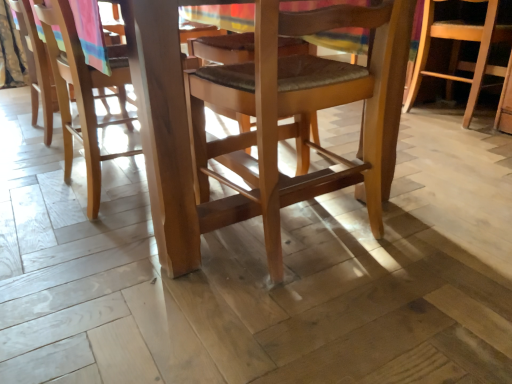
Question: From the image's perspective, does wooden chair at center, which is the 2th chair from left to right, appear lower than wooden chair at center, positioned as the 3th chair in left-to-right order?

Choices:
 (A) yes
 (B) no

Answer: (A)

Question: Can you confirm if wooden chair at center, the 3th chair from the back, is bigger than wooden chair at center, which is counted as the 1th chair, starting from the back?

Choices:
 (A) no
 (B) yes

Answer: (B)

Question: Does wooden chair at center, the second chair from the right, have a lesser width compared to wooden chair at center, the first chair viewed from the right?

Choices:
 (A) no
 (B) yes

Answer: (A)

Question: Is wooden chair at center, which appears as the first chair when viewed from the front, shorter than wooden chair at center, positioned as the 3th chair in front-to-back order?

Choices:
 (A) yes
 (B) no

Answer: (B)

Question: Is wooden chair at center, the 3th chair from the back, completely or partially outside of wooden chair at center, positioned as the 3th chair in left-to-right order?

Choices:
 (A) no
 (B) yes

Answer: (B)

Question: Is wooden chair at center, the second chair from the right, wider than wooden chair at center, the first chair viewed from the right?

Choices:
 (A) no
 (B) yes

Answer: (B)

Question: Considering the relative sizes of wooden chair at center, the first chair viewed from the right, and light brown wood chair at left, the 2th chair when ordered from front to back, in the image provided, is wooden chair at center, the first chair viewed from the right, wider than light brown wood chair at left, the 2th chair when ordered from front to back,?

Choices:
 (A) yes
 (B) no

Answer: (A)

Question: From a real-world perspective, is wooden chair at center, which is counted as the 1th chair, starting from the back, beneath light brown wood chair at left, the second chair positioned from the back?

Choices:
 (A) no
 (B) yes

Answer: (B)

Question: Considering the relative sizes of wooden chair at center, the first chair viewed from the right, and light brown wood chair at left, the second chair positioned from the back, in the image provided, is wooden chair at center, the first chair viewed from the right, thinner than light brown wood chair at left, the second chair positioned from the back,?

Choices:
 (A) no
 (B) yes

Answer: (A)

Question: Is wooden chair at center, the first chair viewed from the right, aimed at light brown wood chair at left, placed as the 1th chair when sorted from left to right?

Choices:
 (A) no
 (B) yes

Answer: (A)

Question: Is wooden chair at center, which is counted as the 1th chair, starting from the back, smaller than light brown wood chair at left, placed as the 1th chair when sorted from left to right?

Choices:
 (A) no
 (B) yes

Answer: (A)

Question: Is wooden chair at center, the first chair viewed from the right, not near light brown wood chair at left, the 2th chair when ordered from front to back?

Choices:
 (A) yes
 (B) no

Answer: (A)

Question: Considering the relative sizes of light brown wood chair at left, the second chair positioned from the back, and wooden chair at center, the 3th chair from the back, in the image provided, is light brown wood chair at left, the second chair positioned from the back, taller than wooden chair at center, the 3th chair from the back,?

Choices:
 (A) no
 (B) yes

Answer: (B)